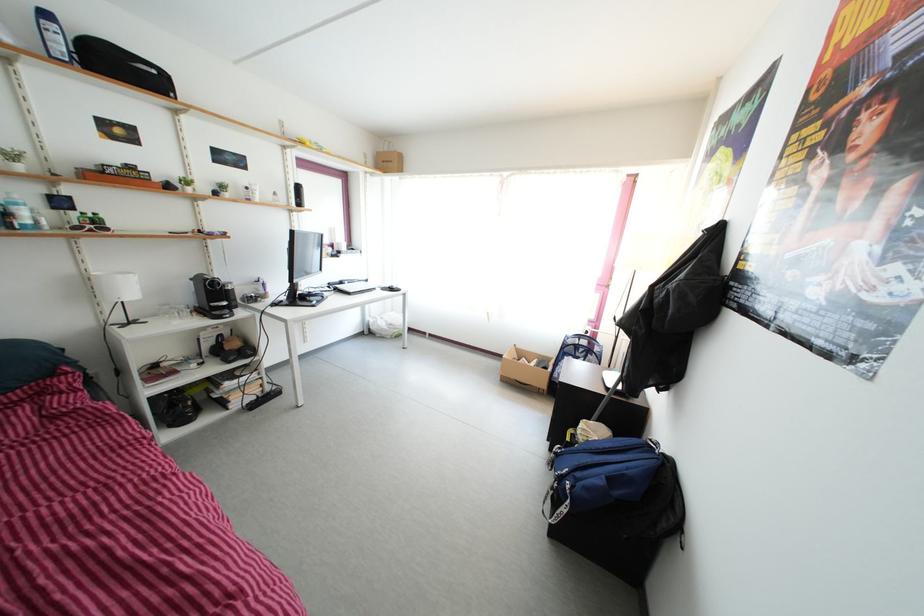
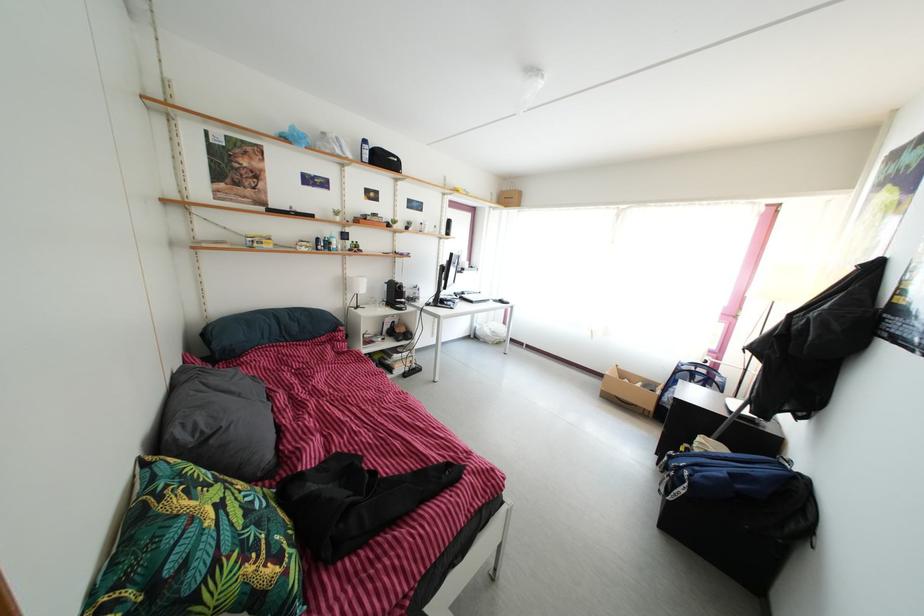
Locate, in the second image, the point that corresponds to the point at 84,270 in the first image.

(350, 277)